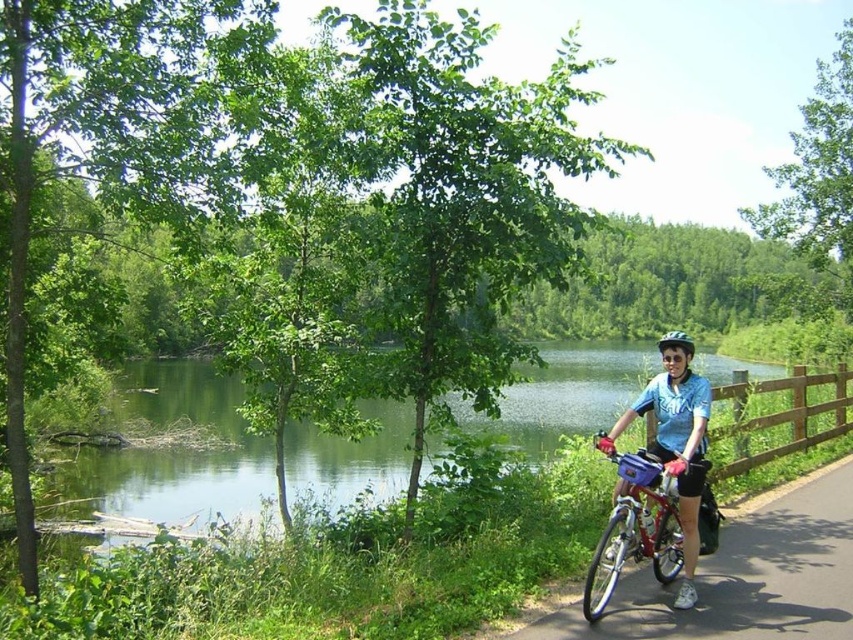
You are a photographer standing on the path and want to take a photo of the brown wooden fence at right and the black matte helmet at upper right. Which object will appear closer to the front of the photo?

The brown wooden fence at right will appear closer to the front of the photo because the black matte helmet at upper right is behind it.

You are standing at the point marked as point (659, 486) in the scene. Looking around, you see a cyclist on the right side of the frame holding their bicycle. What is the color of the fabric at the point you are standing on?

The point (659, 486) is on blue fabric shirt at center, so the color is blue.